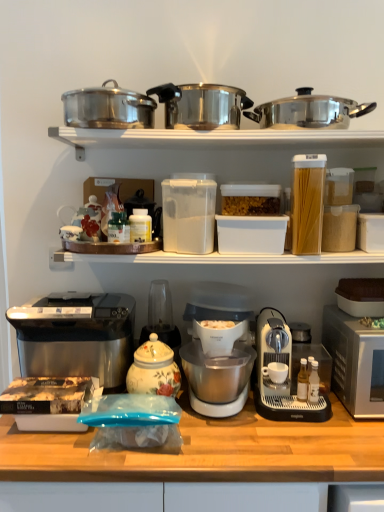
Question: From the image's perspective, would you say metallic pots at upper center is positioned over white matte coffee cup at center?

Choices:
 (A) no
 (B) yes

Answer: (B)

Question: Does metallic pots at upper center have a larger size compared to white matte coffee cup at center?

Choices:
 (A) yes
 (B) no

Answer: (A)

Question: From a real-world perspective, is metallic pots at upper center below white matte coffee cup at center?

Choices:
 (A) no
 (B) yes

Answer: (A)

Question: Can you confirm if metallic pots at upper center is positioned to the left of white matte coffee cup at center?

Choices:
 (A) yes
 (B) no

Answer: (A)

Question: From the image's perspective, does metallic pots at upper center appear lower than white matte coffee cup at center?

Choices:
 (A) no
 (B) yes

Answer: (A)

Question: Is satin silver toaster at left bigger or smaller than clear plastic bag at center?

Choices:
 (A) small
 (B) big

Answer: (A)

Question: Does point (112, 330) appear closer or farther from the camera than point (374, 426)?

Choices:
 (A) farther
 (B) closer

Answer: (A)

Question: In the image, is satin silver toaster at left on the left side or the right side of clear plastic bag at center?

Choices:
 (A) left
 (B) right

Answer: (A)

Question: From the image's perspective, is satin silver toaster at left above or below clear plastic bag at center?

Choices:
 (A) below
 (B) above

Answer: (B)

Question: From the image's perspective, is porcelain floral jar at center, the 4th appliance from the right, above or below clear plastic bag at center?

Choices:
 (A) above
 (B) below

Answer: (A)

Question: In terms of width, does porcelain floral jar at center, the 4th appliance from the right, look wider or thinner when compared to clear plastic bag at center?

Choices:
 (A) thin
 (B) wide

Answer: (A)

Question: Based on their positions, is porcelain floral jar at center, the 4th appliance from the right, located to the left or right of clear plastic bag at center?

Choices:
 (A) left
 (B) right

Answer: (A)

Question: Is porcelain floral jar at center, the 4th appliance from the right, spatially inside clear plastic bag at center, or outside of it?

Choices:
 (A) outside
 (B) inside

Answer: (A)

Question: Visually, is metallic silver coffee maker at lower right, which is the 2th coffee maker from left to right, positioned to the left or to the right of polished stainless steel pot at upper right, positioned as the first kitchen appliance in top-to-bottom order?

Choices:
 (A) right
 (B) left

Answer: (B)

Question: Is metallic silver coffee maker at lower right, which is counted as the first coffee maker, starting from the right, bigger or smaller than polished stainless steel pot at upper right, acting as the 4th kitchen appliance starting from the bottom?

Choices:
 (A) big
 (B) small

Answer: (A)